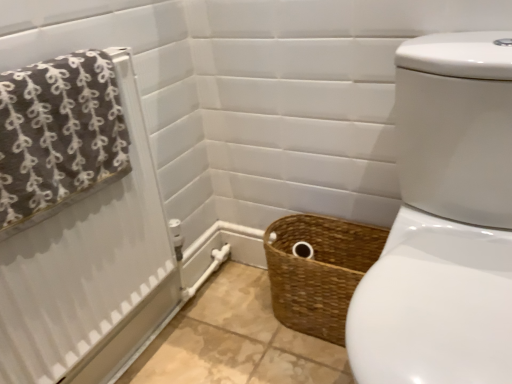
Question: Can you confirm if brown woven basket at lower center is thinner than brown textured towel at left?

Choices:
 (A) yes
 (B) no

Answer: (B)

Question: From a real-world perspective, is brown woven basket at lower center physically below brown textured towel at left?

Choices:
 (A) no
 (B) yes

Answer: (B)

Question: Can you confirm if brown woven basket at lower center is positioned to the left of brown textured towel at left?

Choices:
 (A) yes
 (B) no

Answer: (B)

Question: Could you tell me if brown woven basket at lower center is facing brown textured towel at left?

Choices:
 (A) no
 (B) yes

Answer: (A)

Question: Considering the relative sizes of brown woven basket at lower center and brown textured towel at left in the image provided, is brown woven basket at lower center wider than brown textured towel at left?

Choices:
 (A) yes
 (B) no

Answer: (A)

Question: From the image's perspective, is brown woven basket at lower center located beneath brown textured towel at left?

Choices:
 (A) yes
 (B) no

Answer: (A)

Question: Is brown textured towel at left facing towards brown woven basket at lower center?

Choices:
 (A) yes
 (B) no

Answer: (B)

Question: Is brown textured towel at left at the right side of brown woven basket at lower center?

Choices:
 (A) no
 (B) yes

Answer: (A)

Question: Does brown textured towel at left have a lesser width compared to brown woven basket at lower center?

Choices:
 (A) yes
 (B) no

Answer: (A)

Question: Is brown textured towel at left touching brown woven basket at lower center?

Choices:
 (A) yes
 (B) no

Answer: (B)

Question: Is brown woven basket at lower center completely or partially inside brown textured towel at left?

Choices:
 (A) yes
 (B) no

Answer: (B)

Question: Considering the relative sizes of brown textured towel at left and brown woven basket at lower center in the image provided, is brown textured towel at left smaller than brown woven basket at lower center?

Choices:
 (A) yes
 (B) no

Answer: (A)

Question: Is brown woven basket at lower center wider than brown fabric towel at upper left?

Choices:
 (A) yes
 (B) no

Answer: (A)